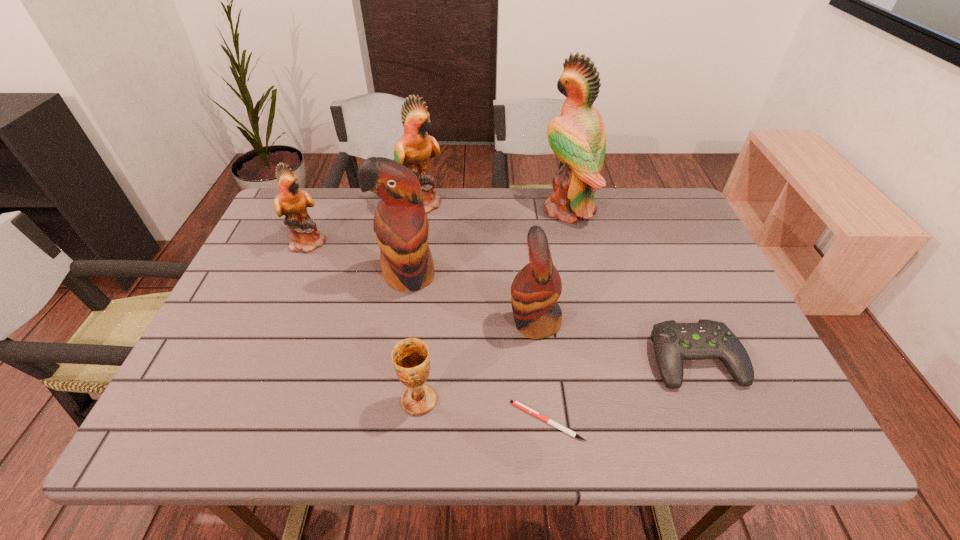
Where is `object positioned at the left edge`? Image resolution: width=960 pixels, height=540 pixels. object positioned at the left edge is located at coordinates (292, 202).

In order to click on object present at the right edge in this screenshot , I will do `click(673, 342)`.

The image size is (960, 540). Identify the location of object present at the far left corner. (292, 202).

This screenshot has width=960, height=540. What are the coordinates of `free space at the far edge of the desktop` in the screenshot? It's located at (460, 201).

The image size is (960, 540). In the image, there is a desktop. In order to click on free space at the near edge in this screenshot , I will do `click(281, 440)`.

The width and height of the screenshot is (960, 540). In the image, there is a desktop. Find the location of `vacant region at the left edge`. vacant region at the left edge is located at coordinates [238, 338].

You are a GUI agent. You are given a task and a screenshot of the screen. Output one action in this format:
    pyautogui.click(x=<x>, y=<y>)
    Task: Click on the vacant region at the right edge of the desktop
    This screenshot has height=540, width=960.
    Given the screenshot: What is the action you would take?
    pyautogui.click(x=685, y=311)

Where is `vacant space at the far left corner of the desktop`? Image resolution: width=960 pixels, height=540 pixels. vacant space at the far left corner of the desktop is located at coordinates (308, 192).

I want to click on free space between the second green parrot from right to left and the tallest object, so click(x=494, y=206).

Locate an element on the screen. Image resolution: width=960 pixels, height=540 pixels. free space between the shortest object and the control is located at coordinates (621, 390).